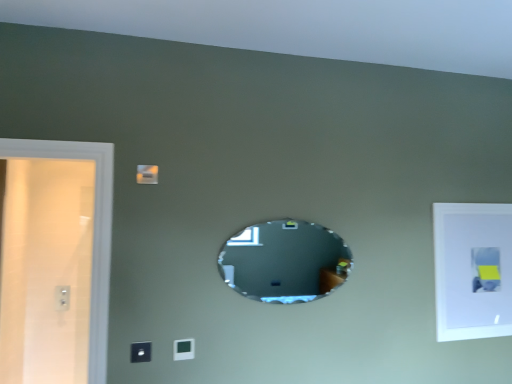
Describe the element at coordinates (141, 352) in the screenshot. I see `satin black switch at lower center, the first light switch from the left` at that location.

Where is `white matte picture frame at upper right`? This screenshot has width=512, height=384. white matte picture frame at upper right is located at coordinates (473, 270).

Measure the distance between point (x=447, y=267) and camera.

The depth of point (x=447, y=267) is 2.31 meters.

Measure the distance between matte white light switch at lower center, which ranks as the second light switch in left-to-right order, and camera.

matte white light switch at lower center, which ranks as the second light switch in left-to-right order, and camera are 1.89 meters apart.

Locate an element on the screen. Image resolution: width=512 pixels, height=384 pixels. white plastic electric outlet at left is located at coordinates (62, 298).

At what (x,y) coordinates should I click in order to perform the action: click on satin black switch at lower center, the first light switch from the left. Please return your answer as a coordinate pair (x, y). This screenshot has width=512, height=384. Looking at the image, I should click on (141, 352).

Is matte white light switch at lower center, which ranks as the second light switch in left-to-right order, at the back of white matte picture frame at upper right?

white matte picture frame at upper right does not have its back to matte white light switch at lower center, which ranks as the second light switch in left-to-right order.

Based on the photo, from a real-world perspective, between white matte picture frame at upper right and matte white light switch at lower center, which appears as the 1th light switch when viewed from the right, who is vertically lower?

matte white light switch at lower center, which appears as the 1th light switch when viewed from the right, is physically lower.

Find the location of `picture frame located behind the matte white light switch at lower center, which ranks as the second light switch in left-to-right order`. picture frame located behind the matte white light switch at lower center, which ranks as the second light switch in left-to-right order is located at coordinates (473, 270).

Is the position of white matte picture frame at upper right more distant than that of matte white light switch at lower center, marked as the first light switch in a back-to-front arrangement?

Yes, white matte picture frame at upper right is further from the viewer.

Is satin black switch at lower center, the first light switch from the left, situated inside white plastic electric outlet at left or outside?

satin black switch at lower center, the first light switch from the left, is outside white plastic electric outlet at left.

Which of these two, satin black switch at lower center, the 2th light switch from the back, or white plastic electric outlet at left, is smaller?

satin black switch at lower center, the 2th light switch from the back, is smaller.

Is satin black switch at lower center, acting as the 2th light switch starting from the right, taller than white plastic electric outlet at left?

In fact, satin black switch at lower center, acting as the 2th light switch starting from the right, may be shorter than white plastic electric outlet at left.

From the image's perspective, which is below, satin black switch at lower center, which appears as the first light switch when viewed from the front, or white plastic electric outlet at left?

white plastic electric outlet at left appears lower in the image.

Is oval mirror at center next to white plastic electric outlet at left?

They are not placed beside each other.

Considering the relative sizes of oval mirror at center and white plastic electric outlet at left in the image provided, is oval mirror at center taller than white plastic electric outlet at left?

Correct, oval mirror at center is much taller as white plastic electric outlet at left.

From a real-world perspective, is oval mirror at center physically located above or below white plastic electric outlet at left?

oval mirror at center is above white plastic electric outlet at left.

How distant is oval mirror at center from white plastic electric outlet at left?

A distance of 2.72 meters exists between oval mirror at center and white plastic electric outlet at left.

Is oval mirror at center in front of or behind matte white light switch at lower center, marked as the first light switch in a back-to-front arrangement, in the image?

oval mirror at center is behind matte white light switch at lower center, marked as the first light switch in a back-to-front arrangement.

From a real-world perspective, which is physically above, oval mirror at center or matte white light switch at lower center, which appears as the 1th light switch when viewed from the right?

From a 3D spatial view, oval mirror at center is above.

Is oval mirror at center in contact with matte white light switch at lower center, which appears as the 1th light switch when viewed from the right?

No, oval mirror at center is not in contact with matte white light switch at lower center, which appears as the 1th light switch when viewed from the right.

Which is further, (454, 226) or (62, 300)?

The point (62, 300) is more distant.

Considering the positions of objects white matte picture frame at upper right and white plastic electric outlet at left in the image provided, who is behind, white matte picture frame at upper right or white plastic electric outlet at left?

white plastic electric outlet at left is more distant.

In terms of height, does white matte picture frame at upper right look taller or shorter compared to white plastic electric outlet at left?

Clearly, white matte picture frame at upper right is taller compared to white plastic electric outlet at left.

Looking at this image, which of these two, white plastic electric outlet at left or oval mirror at center, is wider?

Wider between the two is oval mirror at center.

Would you say oval mirror at center is part of white plastic electric outlet at left's contents?

No, white plastic electric outlet at left does not contain oval mirror at center.

Is white plastic electric outlet at left facing away from oval mirror at center?

No, oval mirror at center is not at the back of white plastic electric outlet at left.

Which is in front, white plastic electric outlet at left or oval mirror at center?

oval mirror at center is more forward.

Does white plastic electric outlet at left have a smaller size compared to white matte picture frame at upper right?

Indeed, white plastic electric outlet at left has a smaller size compared to white matte picture frame at upper right.

Is white plastic electric outlet at left next to white matte picture frame at upper right and touching it?

There is a gap between white plastic electric outlet at left and white matte picture frame at upper right.

Does white plastic electric outlet at left have a lesser height compared to white matte picture frame at upper right?

Correct, white plastic electric outlet at left is not as tall as white matte picture frame at upper right.

Locate an element on the screen. The width and height of the screenshot is (512, 384). light switch that is the 2nd one when counting downward from the white matte picture frame at upper right (from the image's perspective) is located at coordinates (183, 349).

Image resolution: width=512 pixels, height=384 pixels. I want to click on electric outlet below the satin black switch at lower center, which appears as the first light switch when viewed from the front (from a real-world perspective), so click(62, 298).

From the image, which object appears to be nearer to white plastic electric outlet at left, matte white light switch at lower center, which ranks as the second light switch in left-to-right order, or satin black switch at lower center, which appears as the first light switch when viewed from the front?

satin black switch at lower center, which appears as the first light switch when viewed from the front, lies closer to white plastic electric outlet at left than the other object.

Considering their positions, is satin black switch at lower center, which appears as the first light switch when viewed from the front, positioned closer to white plastic electric outlet at left than oval mirror at center?

Based on the image, satin black switch at lower center, which appears as the first light switch when viewed from the front, appears to be nearer to white plastic electric outlet at left.

In the scene shown: Estimate the real-world distances between objects in this image. Which object is closer to satin black switch at lower center, which appears as the first light switch when viewed from the front, oval mirror at center or matte white light switch at lower center, which appears as the 1th light switch when viewed from the right?

matte white light switch at lower center, which appears as the 1th light switch when viewed from the right.

From the image, which object appears to be farther from white matte picture frame at upper right, satin black switch at lower center, acting as the 2th light switch starting from the right, or oval mirror at center?

Based on the image, satin black switch at lower center, acting as the 2th light switch starting from the right, appears to be further to white matte picture frame at upper right.

Looking at the image, which one is located further to white plastic electric outlet at left, white matte picture frame at upper right or matte white light switch at lower center, which appears as the 1th light switch when viewed from the right?

The object further to white plastic electric outlet at left is white matte picture frame at upper right.

Estimate the real-world distances between objects in this image. Which object is further from white matte picture frame at upper right, oval mirror at center or satin black switch at lower center, the first light switch from the left?

satin black switch at lower center, the first light switch from the left, is positioned further to the anchor white matte picture frame at upper right.

Estimate the real-world distances between objects in this image. Which object is closer to white matte picture frame at upper right, satin black switch at lower center, the 2th light switch from the back, or matte white light switch at lower center, marked as the first light switch in a back-to-front arrangement?

Among the two, matte white light switch at lower center, marked as the first light switch in a back-to-front arrangement, is located nearer to white matte picture frame at upper right.

Which object lies nearer to the anchor point white matte picture frame at upper right, oval mirror at center or matte white light switch at lower center, marked as the first light switch in a back-to-front arrangement?

oval mirror at center lies closer to white matte picture frame at upper right than the other object.

The width and height of the screenshot is (512, 384). I want to click on mirror between satin black switch at lower center, the 2th light switch from the back, and white plastic electric outlet at left, along the z-axis, so click(285, 261).

I want to click on mirror located between matte white light switch at lower center, marked as the first light switch in a back-to-front arrangement, and white matte picture frame at upper right in the left-right direction, so click(285, 261).

Locate an element on the screen. The width and height of the screenshot is (512, 384). mirror located between white plastic electric outlet at left and white matte picture frame at upper right in the left-right direction is located at coordinates (285, 261).

The image size is (512, 384). What are the coordinates of `light switch between satin black switch at lower center, the 2th light switch from the back, and oval mirror at center from left to right` in the screenshot? It's located at (183, 349).